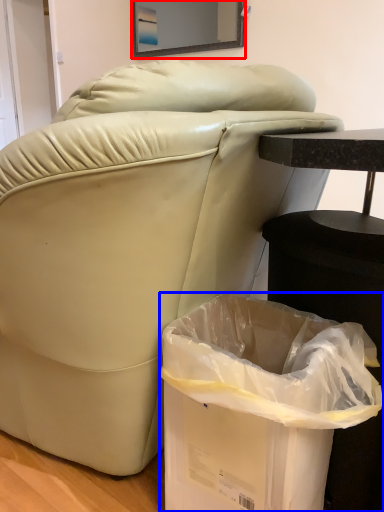
Question: Which object is further to the camera taking this photo, mirror (highlighted by a red box) or trash bin/can (highlighted by a blue box)?

Choices:
 (A) mirror
 (B) trash bin/can

Answer: (A)